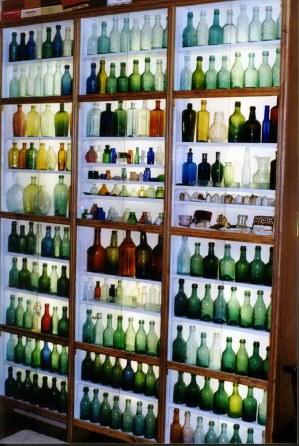
This screenshot has height=446, width=299. Find the location of `middle shelves`. middle shelves is located at coordinates (65, 223), (113, 348), (62, 342), (182, 366), (200, 233), (156, 230).